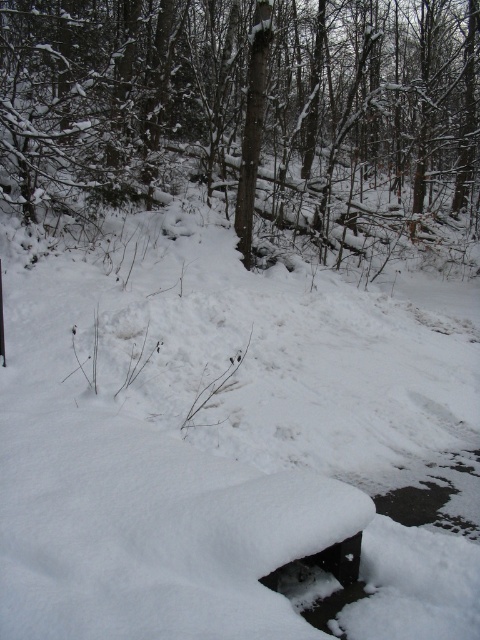
You are standing at the edge of a snowy forest and see a point marked at coordinates (224, 440). According to the scene description, where is this point located?

The point is located on white fluffy snow at center.

You are a hiker trying to cross the forest. You see the white fluffy snow at center and the smooth brown tree trunk at center. Which one is lower to the ground?

The white fluffy snow at center is shorter than the smooth brown tree trunk at center, so the white fluffy snow at center is lower to the ground.